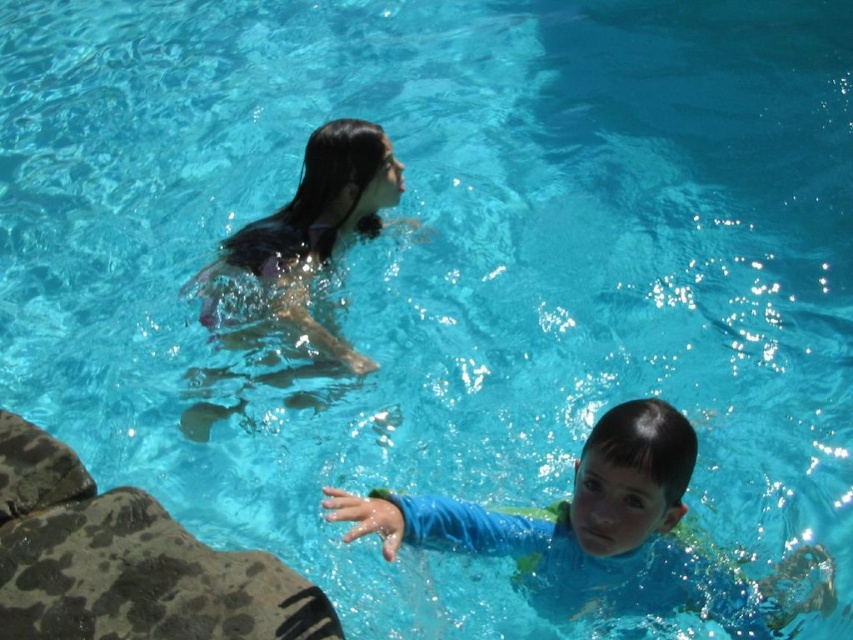
Is blue rubber swim suit at center thinner than wet hair at upper center?

No, blue rubber swim suit at center is not thinner than wet hair at upper center.

Is blue rubber swim suit at center to the right of wet hair at upper center from the viewer's perspective?

Yes, blue rubber swim suit at center is to the right of wet hair at upper center.

Is point (621, 472) positioned before point (347, 364)?

Yes, it is.

Identify the location of blue rubber swim suit at center. This screenshot has width=853, height=640. click(601, 532).